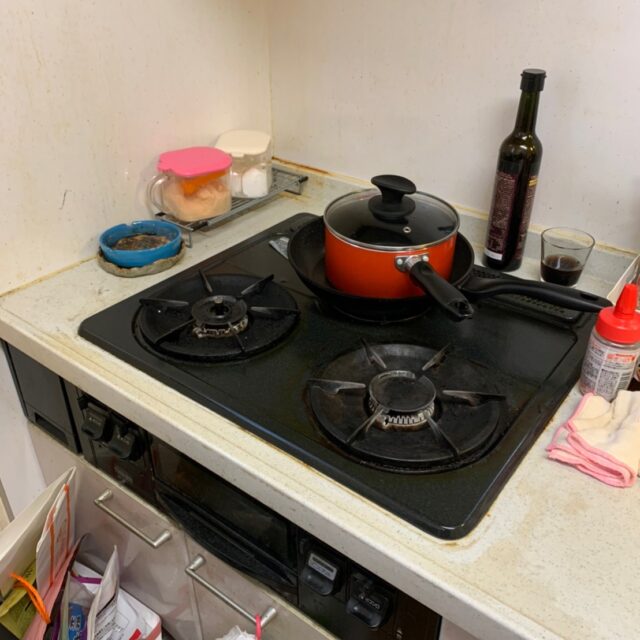
You are a GUI agent. You are given a task and a screenshot of the screen. Output one action in this format:
    pyautogui.click(x=<x>, y=<y>)
    Task: Click on the skillet
    
    Given the screenshot: What is the action you would take?
    pyautogui.click(x=467, y=269)